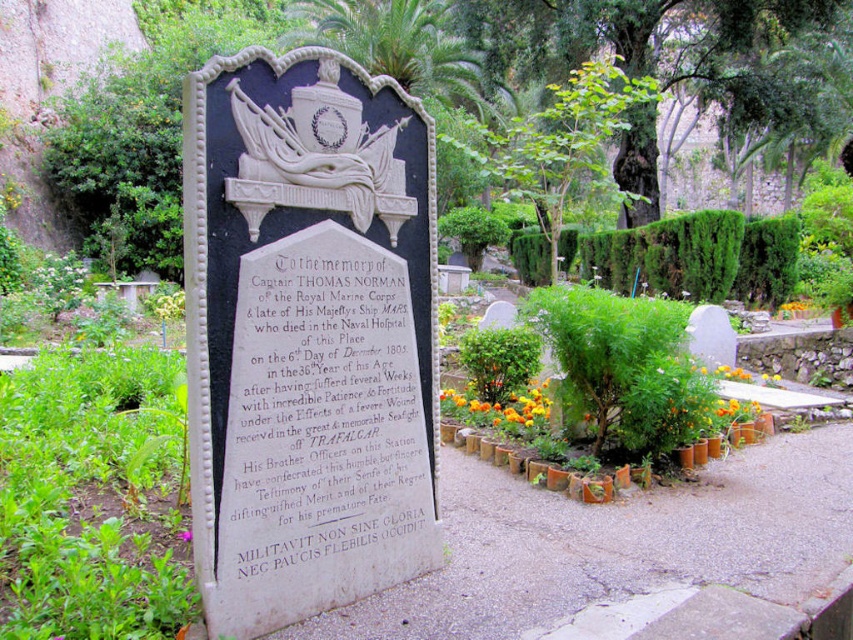
Is orange matte flower at center further to camera compared to orange petal at center?

That is True.

Which is in front, point (799, 300) or point (177, 536)?

Point (177, 536) is in front.

This screenshot has height=640, width=853. What are the coordinates of `orange matte flower at center` in the screenshot? It's located at (798, 305).

Between point (337, 525) and point (189, 534), which one is positioned in front?

Point (337, 525)

Where is `black stone plaque at center`? black stone plaque at center is located at coordinates (325, 419).

Locate an element on the screen. The height and width of the screenshot is (640, 853). black stone plaque at center is located at coordinates (325, 419).

Which of these two, white marble gravestone at center or orange fabric flower at center, stands taller?

white marble gravestone at center

Consider the image. How much distance is there between white marble gravestone at center and orange fabric flower at center?

white marble gravestone at center is 2.40 meters from orange fabric flower at center.

Identify the location of white marble gravestone at center. This screenshot has width=853, height=640. (306, 336).

The image size is (853, 640). I want to click on white marble gravestone at center, so (306, 336).